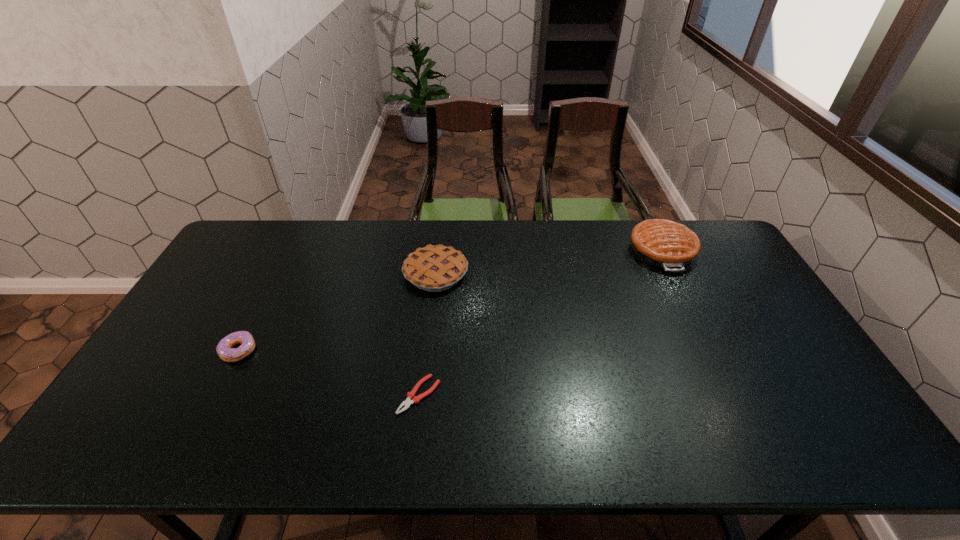
Identify the location of free space between the third farthest object and the left pie. (337, 312).

This screenshot has width=960, height=540. Identify the location of free space between the third tallest object and the rightmost object. (450, 300).

Find the location of a particular element. The width and height of the screenshot is (960, 540). vacant area that lies between the right pie and the left pie is located at coordinates (549, 262).

This screenshot has height=540, width=960. Identify the location of unoccupied area between the leftmost object and the shortest object. (329, 373).

The width and height of the screenshot is (960, 540). I want to click on unoccupied position between the shorter pie and the tallest object, so click(549, 262).

Identify the location of free spot between the shorter pie and the second nearest object. The height and width of the screenshot is (540, 960). (337, 312).

Locate an element on the screen. The image size is (960, 540). empty location between the shorter pie and the shortest object is located at coordinates (427, 334).

The width and height of the screenshot is (960, 540). Find the location of `empty location between the shorter pie and the taller pie`. empty location between the shorter pie and the taller pie is located at coordinates (549, 262).

The width and height of the screenshot is (960, 540). What are the coordinates of `vacant space that's between the tallest object and the third shortest object` in the screenshot? It's located at (549, 262).

Select which object is the closest to the shorter pie. Please provide its 2D coordinates. Your answer should be formatted as a tuple, i.e. [(x, y)], where the tuple contains the x and y coordinates of a point satisfying the conditions above.

[(411, 398)]